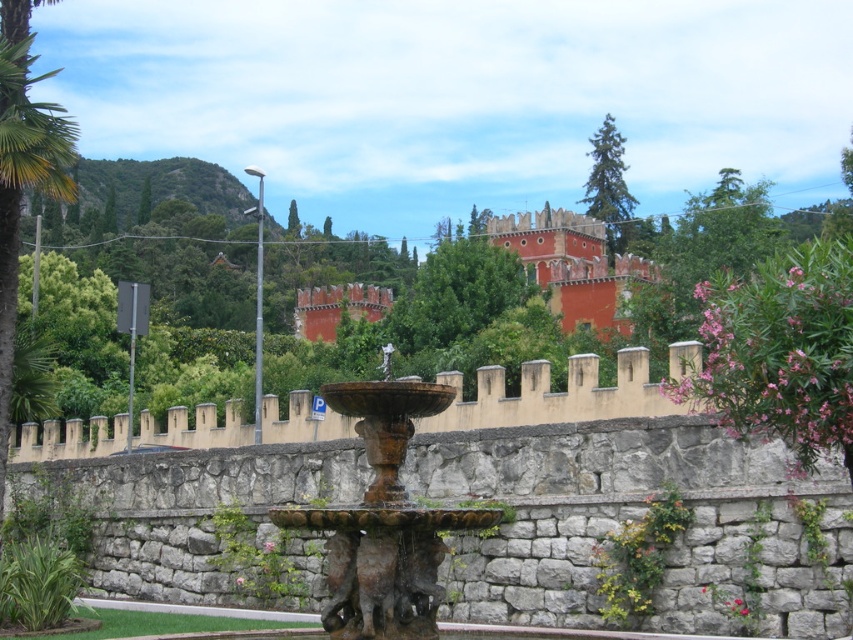
You are a tourist standing in front of the rusty stone fountain at center and want to take a photo of the red matte stone castle at upper center. Since the castle is larger, will you need to zoom out to capture the entire castle in your photo?

The rusty stone fountain at center has a smaller size compared to red matte stone castle at upper center. Since the castle is larger, you will need to zoom out to capture the entire red matte stone castle at upper center in your photo.

You are an architect designing a garden layout. You need to place a new statue that is 3 meters wide between the rusty stone fountain at center and the red matte stone castle at upper center. Based on their widths, will the statue fit between them?

The rusty stone fountain at center is narrower than the red matte stone castle at upper center. However, the question is about fitting a 3m wide statue between them, but the description only provides their widths relative to each other, not the distance between them. Thus, insufficient information to determine if the statue will fit.